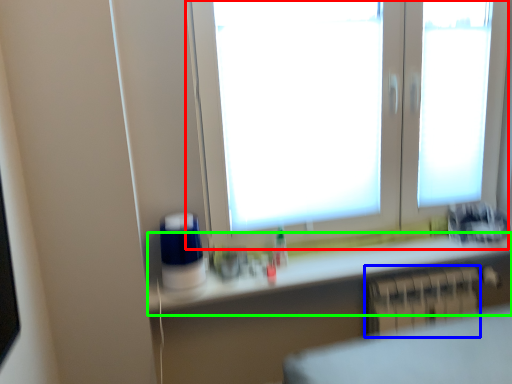
Question: Estimate the real-world distances between objects in this image. Which object is farther from window (highlighted by a red box), radiator (highlighted by a blue box) or counter top (highlighted by a green box)?

Choices:
 (A) radiator
 (B) counter top

Answer: (A)